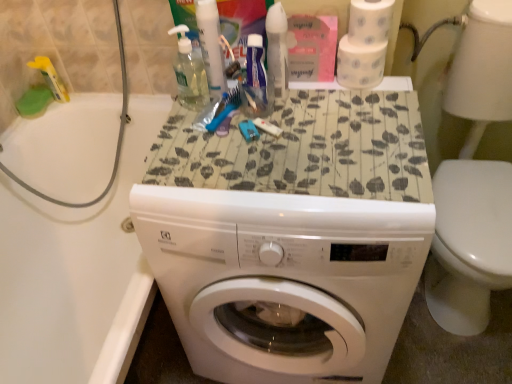
Where is `free location to the right of yellow plastic bottle at upper left, the 2th toiletry from the right`? The height and width of the screenshot is (384, 512). free location to the right of yellow plastic bottle at upper left, the 2th toiletry from the right is located at coordinates (93, 98).